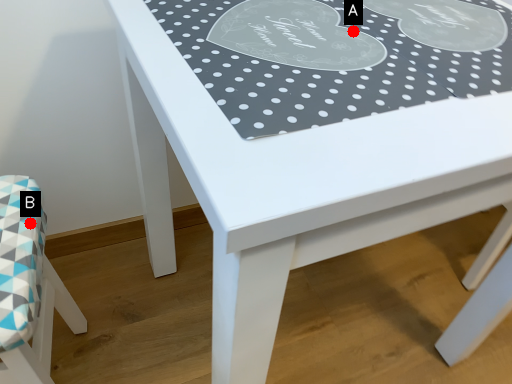
Question: Two points are circled on the image, labeled by A and B beside each circle. Which point is farther to the camera?

Choices:
 (A) A is further
 (B) B is further

Answer: (B)